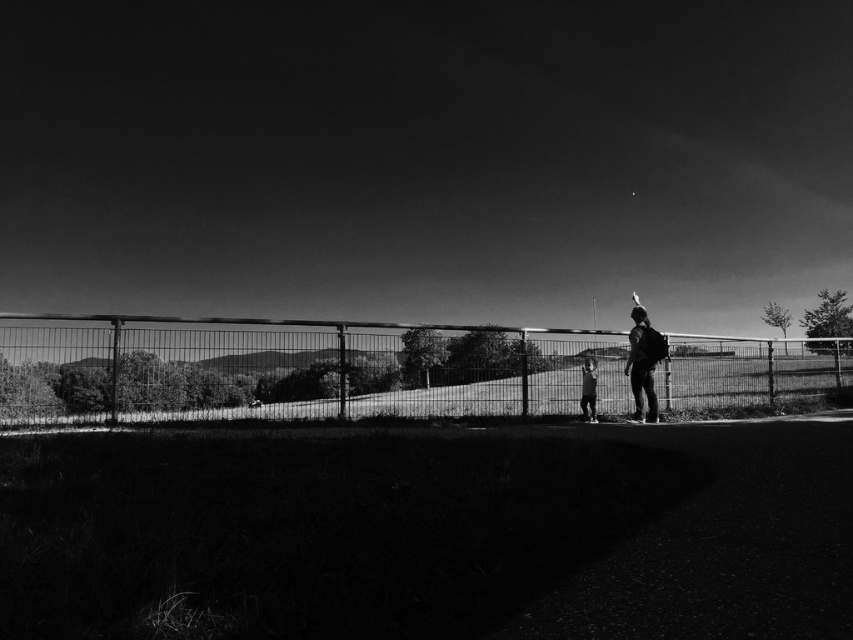
Question: Estimate the real-world distances between objects in this image. Which object is closer to the smooth skin child at center?

Choices:
 (A) metallic fence at center
 (B) metallic wire fence at center
 (C) shiny black skateboard at center

Answer: (C)

Question: Can you confirm if metallic wire fence at center is positioned to the right of shiny black skateboard at center?

Choices:
 (A) no
 (B) yes

Answer: (A)

Question: Which object is positioned farthest from the shiny black skateboard at center?

Choices:
 (A) smooth skin child at center
 (B) metallic wire fence at center
 (C) metallic fence at center

Answer: (C)

Question: Is metallic fence at center positioned at the back of shiny black skateboard at center?

Choices:
 (A) no
 (B) yes

Answer: (B)

Question: Which point appears farthest from the camera in this image?

Choices:
 (A) pyautogui.click(x=633, y=381)
 (B) pyautogui.click(x=451, y=348)

Answer: (B)

Question: Does shiny black skateboard at center appear on the left side of smooth skin child at center?

Choices:
 (A) no
 (B) yes

Answer: (A)